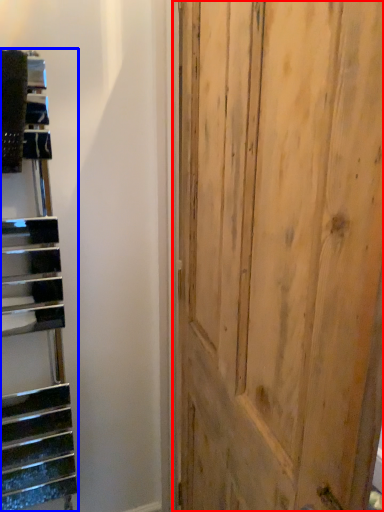
Question: Which of the following is the farthest to the observer, door (highlighted by a red box) or stairwell (highlighted by a blue box)?

Choices:
 (A) door
 (B) stairwell

Answer: (B)